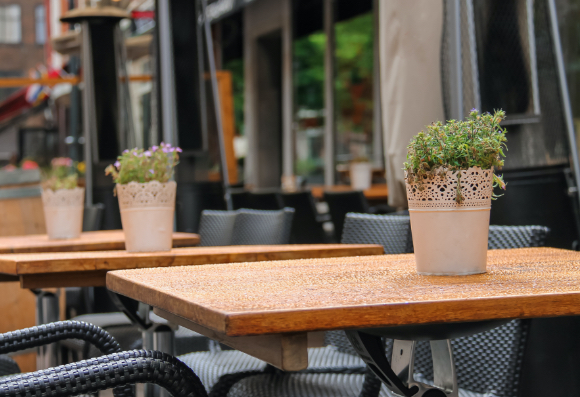
You are a GUI agent. You are given a task and a screenshot of the screen. Output one action in this format:
    pyautogui.click(x=<x>, y=<y>)
    Task: Click on the restaurant windows
    
    Given the screenshot: What is the action you would take?
    pyautogui.click(x=358, y=33), pyautogui.click(x=350, y=103), pyautogui.click(x=300, y=37), pyautogui.click(x=299, y=97), pyautogui.click(x=355, y=74), pyautogui.click(x=311, y=68)